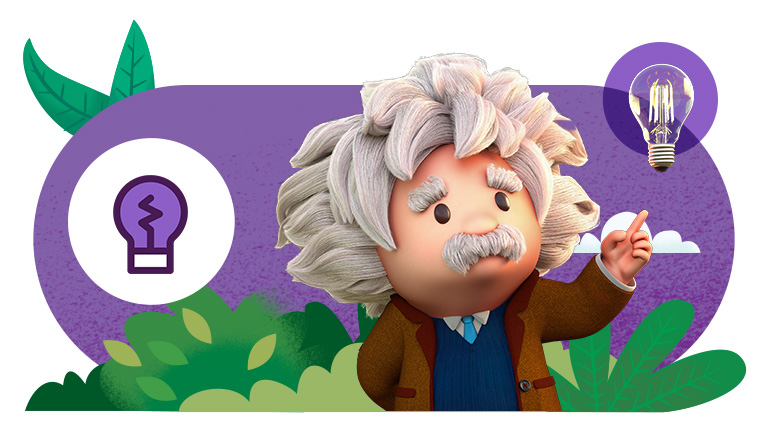
Locate an element on the screen. purple animation lightbulb is located at coordinates (160, 226).